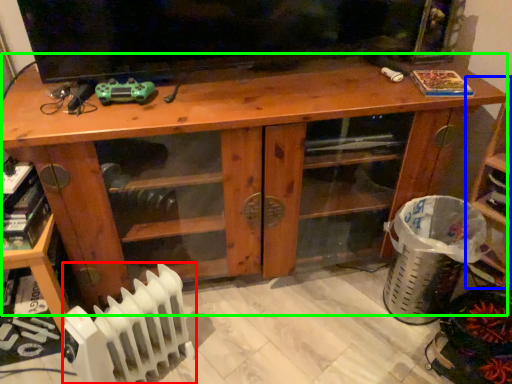
Question: Estimate the real-world distances between objects in this image. Which object is closer to radiator (highlighted by a red box), shelf (highlighted by a blue box) or desk (highlighted by a green box)?

Choices:
 (A) shelf
 (B) desk

Answer: (B)